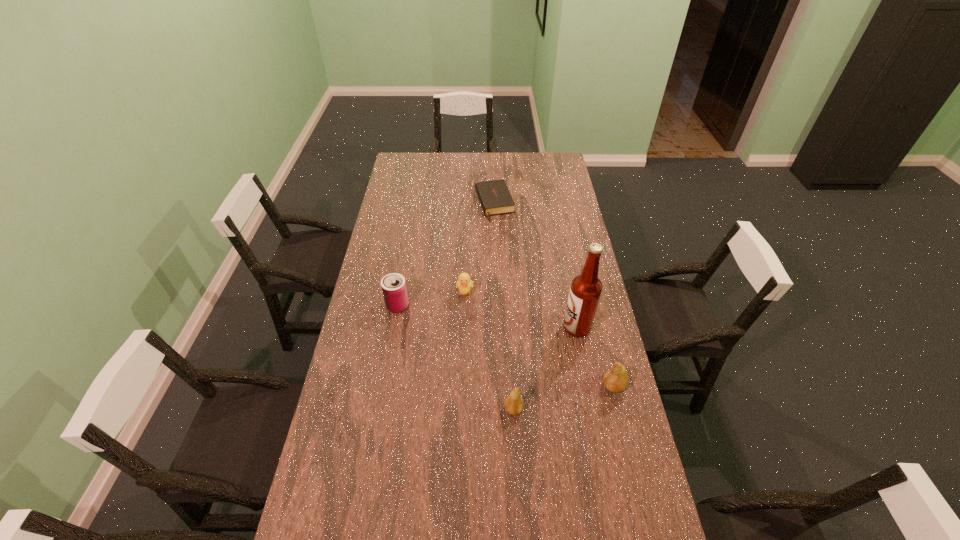
The image size is (960, 540). What are the coordinates of `vacant spot to place a pear on the left` in the screenshot? It's located at (405, 435).